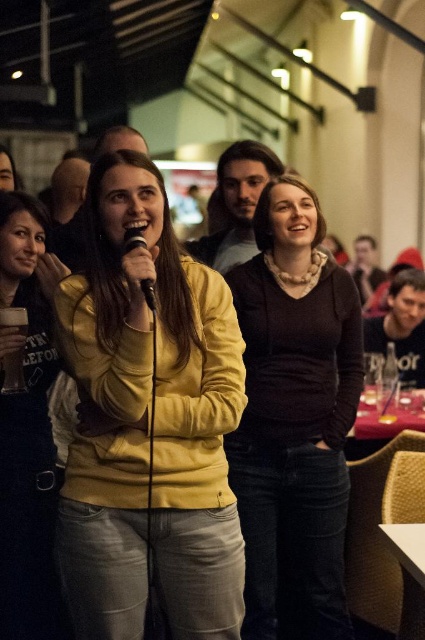
Can you confirm if matte yellow sweater at center is positioned above white textured table at lower right?

Correct, matte yellow sweater at center is located above white textured table at lower right.

Who is more forward, [53,577] or [413,554]?

Positioned in front is point [413,554].

Who is more forward, [14,420] or [404,564]?

Positioned in front is point [404,564].

Where is `matte yellow sweater at center`? Image resolution: width=425 pixels, height=640 pixels. matte yellow sweater at center is located at coordinates (27, 436).

Does matte yellow sweater at center appear under dark blue shirt at center?

Yes, matte yellow sweater at center is below dark blue shirt at center.

Which is more to the right, matte yellow sweater at center or dark blue shirt at center?

dark blue shirt at center is more to the right.

You are a GUI agent. You are given a task and a screenshot of the screen. Output one action in this format:
    pyautogui.click(x=<x>, y=<y>)
    Task: Click on the matte yellow sweater at center
    
    Given the screenshot: What is the action you would take?
    pyautogui.click(x=27, y=436)

Can you confirm if white textured table at lower right is positioned to the right of matte black jacket at right?

Incorrect, white textured table at lower right is not on the right side of matte black jacket at right.

Between white textured table at lower right and matte black jacket at right, which one appears on the right side from the viewer's perspective?

Positioned to the right is matte black jacket at right.

Locate an element on the screen. This screenshot has height=640, width=425. white textured table at lower right is located at coordinates (408, 573).